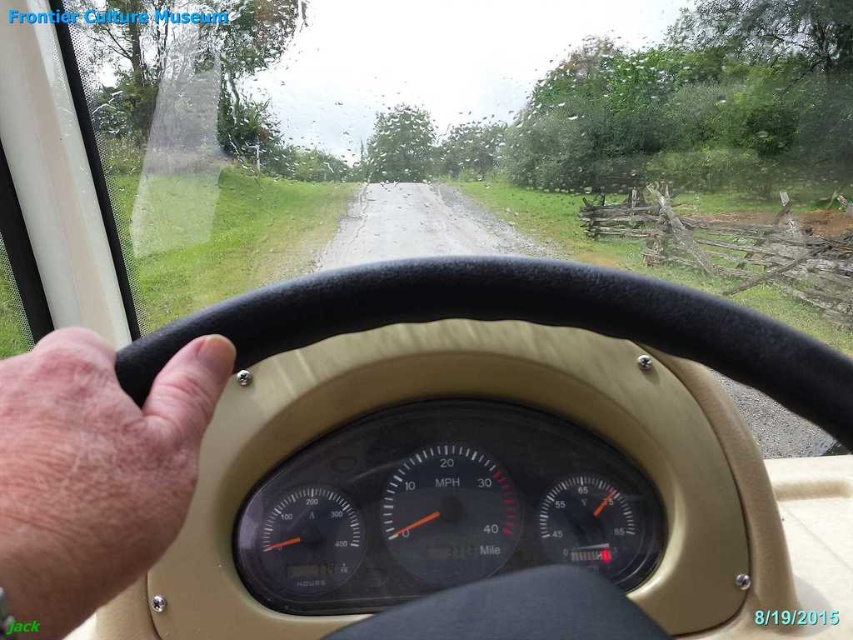
You are sitting in the driver seat of the vehicle and looking through the windshield. There are two points marked on the windshield. One is at coordinate point (527, 481) and the other is at point (200, 417). Which point is closer to your eyes?

Point (527, 481) is closer to your eyes because it is further to the viewer than point (200, 417).